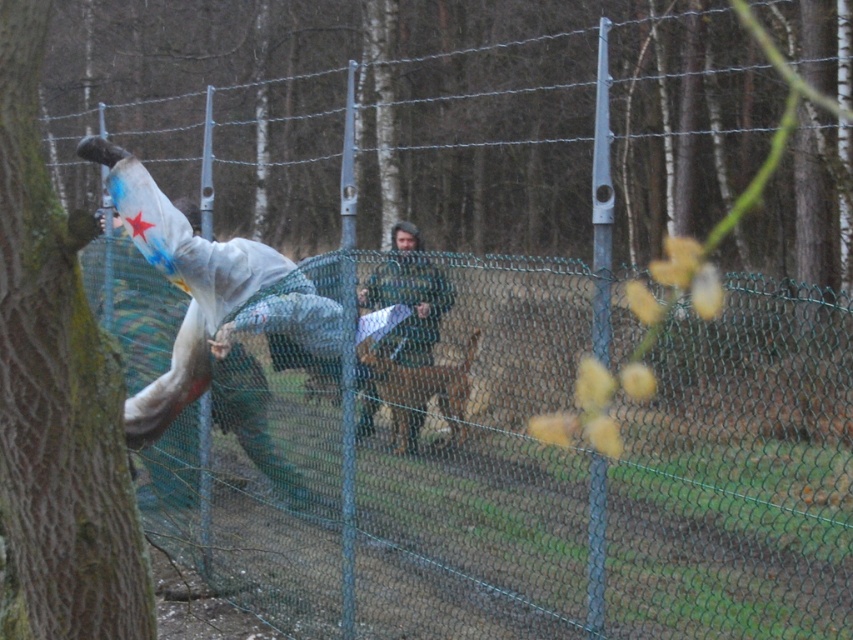
Question: Which point is farther to the camera?

Choices:
 (A) green mossy bark tree at left
 (B) camouflage fabric jacket at center

Answer: (B)

Question: Can you confirm if green mossy bark tree at left is positioned above camouflage fabric jacket at center?

Choices:
 (A) no
 (B) yes

Answer: (B)

Question: Can you confirm if green mossy bark tree at left is smaller than camouflage fabric jacket at center?

Choices:
 (A) no
 (B) yes

Answer: (A)

Question: Which point is closer to the camera?

Choices:
 (A) camouflage fabric jacket at center
 (B) green mossy bark tree at left

Answer: (B)

Question: Is green mossy bark tree at left positioned behind camouflage fabric jacket at center?

Choices:
 (A) yes
 (B) no

Answer: (B)